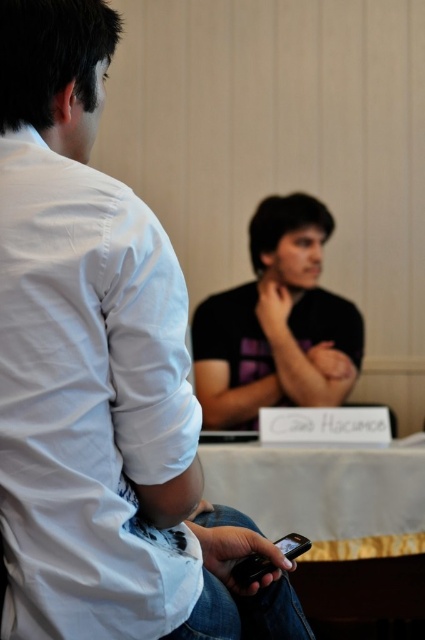
You are attending a meeting and need to place a nameplate exactly at the center of the table. The nameplate is 10 cm wide. The matte black phone at center is currently placed at point 0.589, 0.235. If the table is 1 meter long and 0.5 meters wide, will the nameplate fit perfectly at the center without overlapping the phone?

The matte black phone at center is located at coordinates (99, 376). To determine if the nameplate will fit, we need to calculate the center of the table. Assuming the table coordinates are normalized from 0 to 1, the true center would be at (212, 320). The phone is at 0.589 on the x and 0.235 on the y, which is slightly to the right and lower than the center. The nameplate, being 10 cm wide, would need space around it. Since the phone is not exactly at the center, there might be enough space, but precise

You are organizing a tech showcase and need to place the matte black phone at center and the black matte shirt at center on a display stand. Which object should you place first if the stand has limited space and you want to ensure the thinner item is placed first to avoid blocking the thicker one?

The matte black phone at center is thinner than the black matte shirt at center, so you should place the matte black phone at center first to ensure it doesn not get blocked by the thicker black matte shirt at center.

In the scene shown: You are a server at a banquet hall and need to place a 12 inch long platter on the table. The platter must be placed between the white fabric table at center and the black matte shirt at center. Is there enough space between them to place the platter?

The white fabric table at center and black matte shirt at center are 32.20 inches apart from each other. Since the platter is only 12 inches long, there is sufficient space to place it between them.